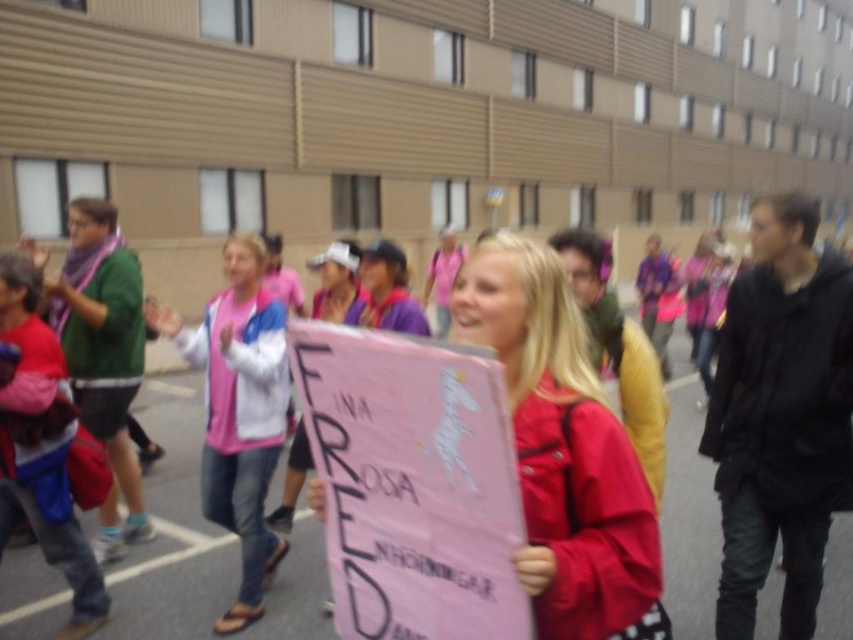
Does point (407, 608) come behind point (570, 436)?

Yes, point (407, 608) is farther from viewer.

Does pink paper sign at center have a greater width compared to matte pink sign at center?

Yes.

Does point (494, 499) lie behind point (590, 609)?

No.

Where is `pink paper sign at center`? This screenshot has width=853, height=640. pink paper sign at center is located at coordinates (412, 483).

Measure the distance between point (498, 420) and camera.

Point (498, 420) is 3.78 feet away from camera.

Is pink paper sign at center above pink fabric jacket at center?

Yes.

Does point (413, 600) come farther from viewer compared to point (224, 266)?

No.

Identify the location of pink paper sign at center. (412, 483).

Is matte pink sign at center bigger than pink fabric jacket at center?

Actually, matte pink sign at center might be smaller than pink fabric jacket at center.

Can you confirm if matte pink sign at center is wider than pink fabric jacket at center?

In fact, matte pink sign at center might be narrower than pink fabric jacket at center.

Which is in front, point (602, 540) or point (260, 584)?

Point (602, 540) is in front.

Where is `matte pink sign at center`? The width and height of the screenshot is (853, 640). matte pink sign at center is located at coordinates (563, 451).